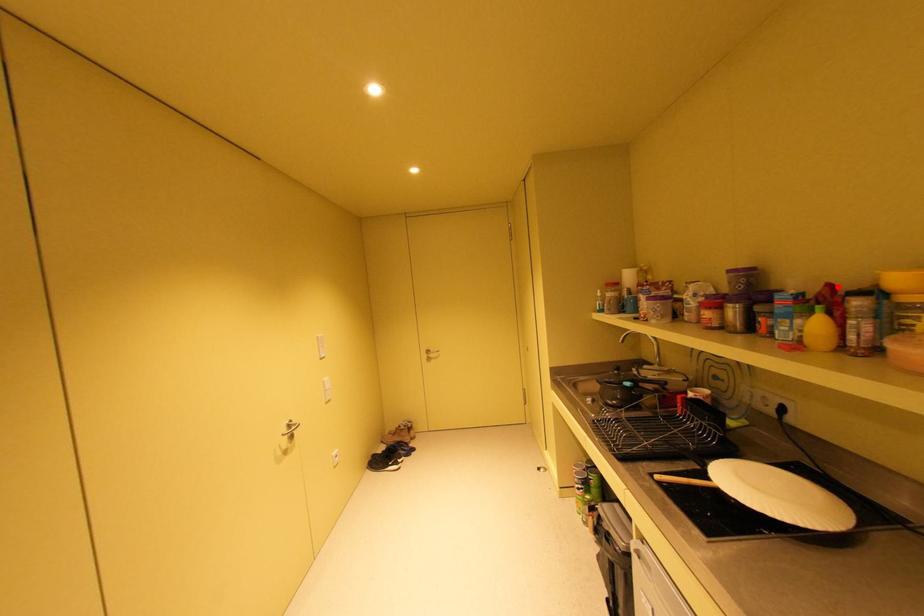
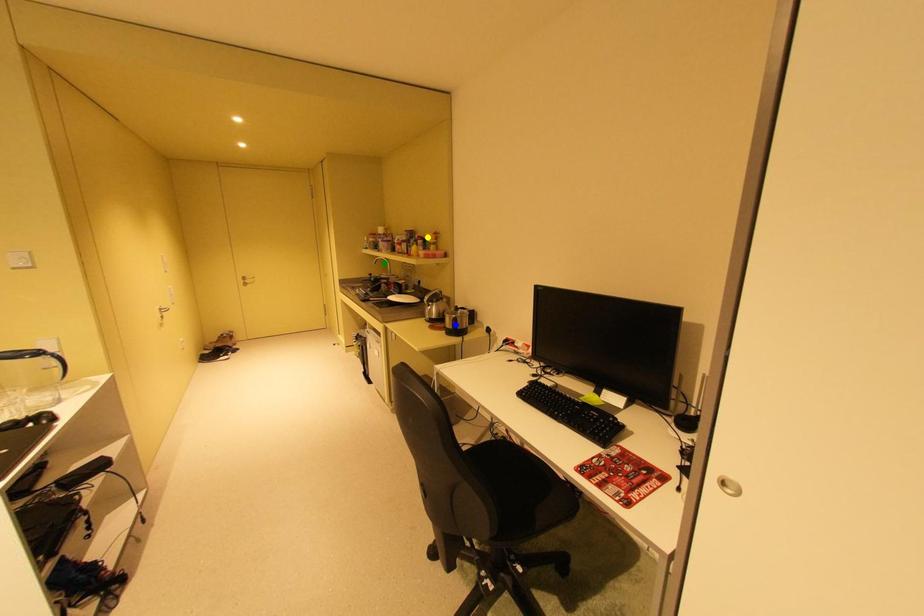
Question: I am providing you with two images of the same scene from different viewpoints. A red point is marked on the first image. You are given multiple points on the second image. Can you choose the point in image 2 that corresponds to the point in image 1?

Choices:
 (A) green point
 (B) blue point
 (C) yellow point

Answer: (C)